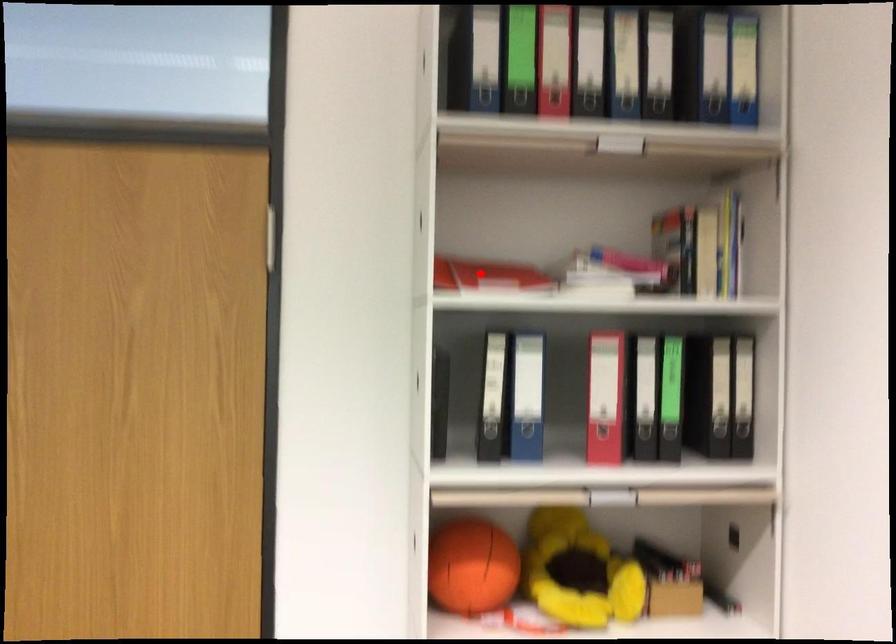
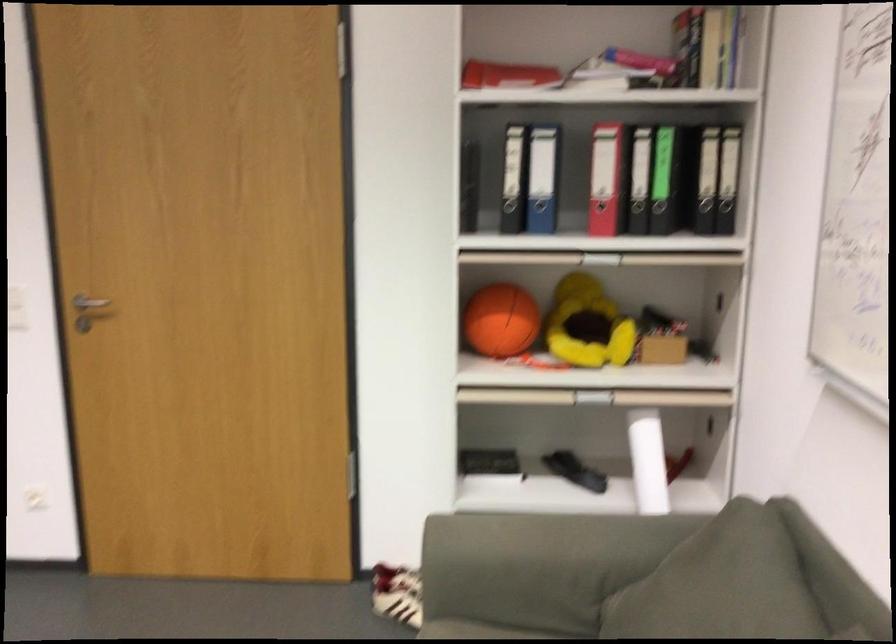
Question: A red point is marked in image1. In image2, is the corresponding 3D point closer to the camera or farther? Reply with the corresponding letter.

Choices:
 (A) The corresponding 3D point is closer.
 (B) The corresponding 3D point is farther.

Answer: (B)